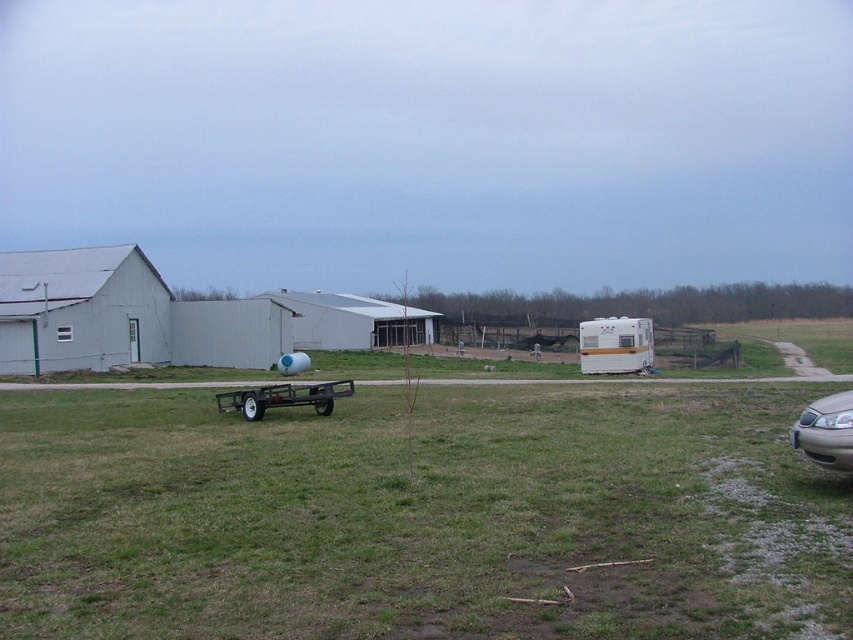
Question: Which point is farther to the camera?

Choices:
 (A) white vinyl camper at center-right
 (B) gold metallic sedan at lower right
 (C) metallic trailer at center

Answer: (A)

Question: Estimate the real-world distances between objects in this image. Which object is farther from the white matte barn at left?

Choices:
 (A) metallic trailer at center
 (B) gold metallic sedan at lower right

Answer: (B)

Question: Can you confirm if white matte barn at left is positioned below metallic trailer at center?

Choices:
 (A) yes
 (B) no

Answer: (B)

Question: Where is white matte barn at left located in relation to metallic trailer at center in the image?

Choices:
 (A) right
 (B) left

Answer: (B)

Question: Which object is positioned closest to the white matte barn at center?

Choices:
 (A) metallic trailer at center
 (B) white matte barn at left
 (C) green grass at center
 (D) white vinyl camper at center-right

Answer: (B)

Question: Where is white matte barn at left located in relation to metallic trailer at center in the image?

Choices:
 (A) below
 (B) above

Answer: (B)